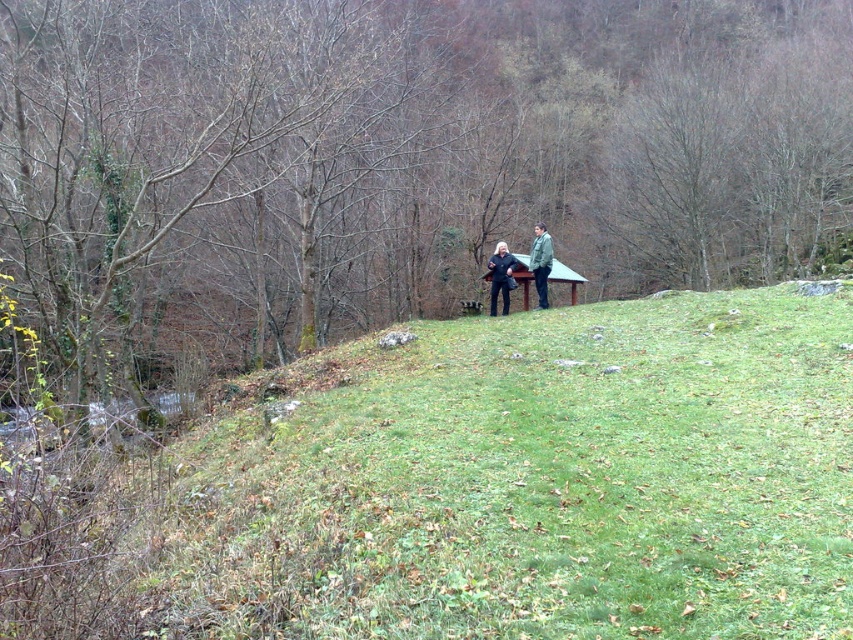
Question: Does black matte jacket at center lie behind green matte jacket at center?

Choices:
 (A) no
 (B) yes

Answer: (B)

Question: Estimate the real-world distances between objects in this image. Which object is closer to the brown bark tree at center?

Choices:
 (A) green grassy hillside at center
 (B) black matte jacket at center
 (C) green matte jacket at center
 (D) dark green fabric jacket at center

Answer: (A)

Question: Where is brown bark tree at center located in relation to black matte jacket at center in the image?

Choices:
 (A) left
 (B) right

Answer: (B)

Question: Which object is positioned closest to the brown bark tree at center?

Choices:
 (A) dark green fabric jacket at center
 (B) green matte jacket at center
 (C) green grassy hillside at center

Answer: (C)

Question: Is black matte jacket at center above green matte jacket at center?

Choices:
 (A) no
 (B) yes

Answer: (A)

Question: Which object is farther from the camera taking this photo?

Choices:
 (A) dark green fabric jacket at center
 (B) green matte jacket at center
 (C) brown bark tree at center
 (D) green grassy hillside at center

Answer: (A)